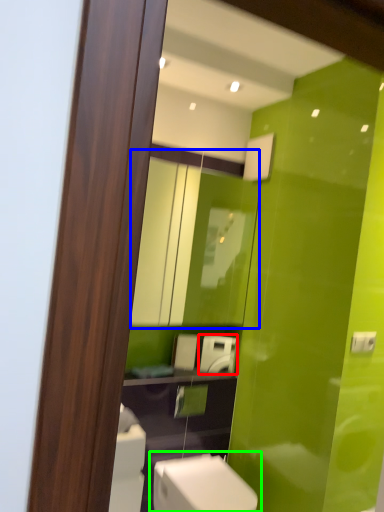
Question: Considering the real-world distances, which object is farthest from appliance (highlighted by a red box)? mirror (highlighted by a blue box) or toilet (highlighted by a green box)?

Choices:
 (A) mirror
 (B) toilet

Answer: (B)